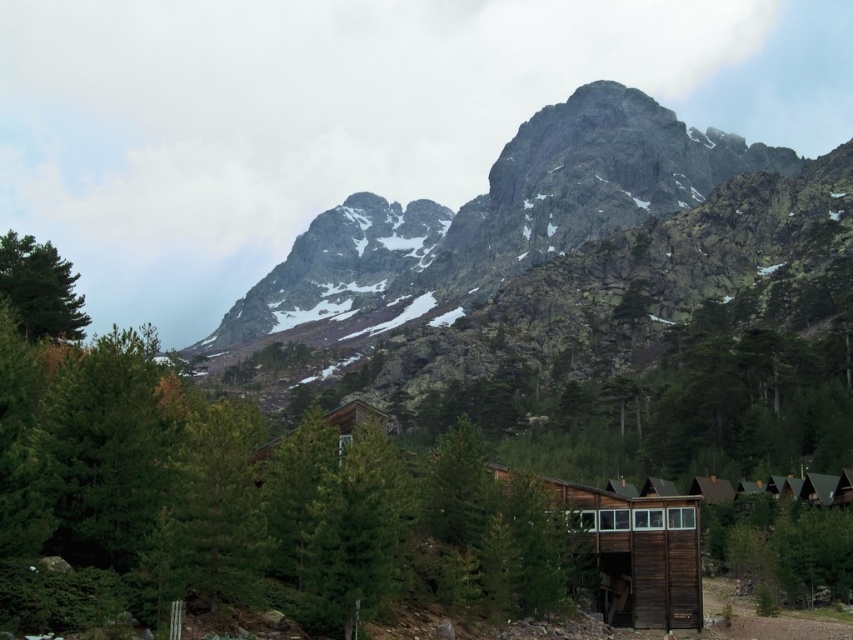
Question: Which of the following is the farthest from the observer?

Choices:
 (A) green matte tree at upper left
 (B) rocky gray mountain at upper center
 (C) wooden cabin at lower right

Answer: (B)

Question: Is green matte tree at upper center further to camera compared to green matte tree at upper left?

Choices:
 (A) yes
 (B) no

Answer: (B)

Question: Which point is farther from the camera taking this photo?

Choices:
 (A) (35, 339)
 (B) (618, 349)

Answer: (B)

Question: Where is green matte tree at upper center located in relation to green matte tree at upper left in the image?

Choices:
 (A) above
 (B) below

Answer: (B)

Question: Is green matte tree at upper center bigger than green matte tree at upper left?

Choices:
 (A) no
 (B) yes

Answer: (B)

Question: Among these points, which one is farthest from the camera?

Choices:
 (A) (532, 348)
 (B) (126, 557)
 (C) (61, 300)

Answer: (A)